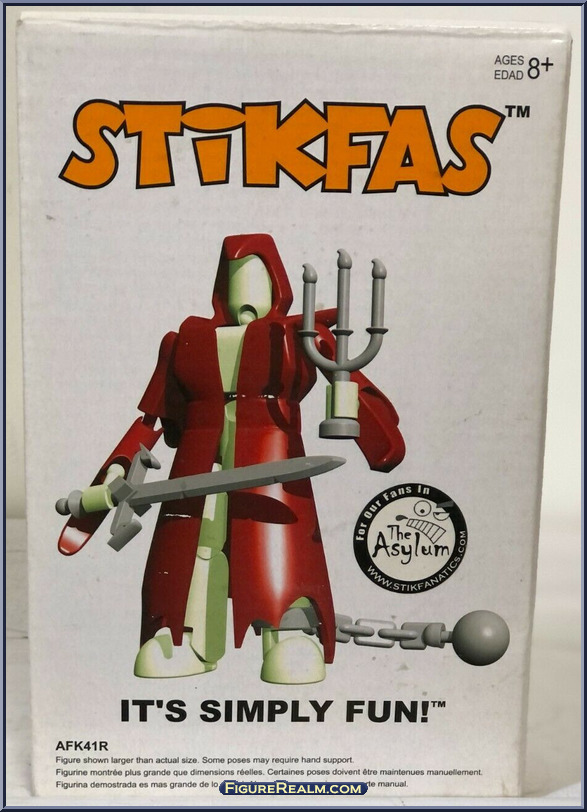
Image resolution: width=587 pixels, height=812 pixels. I want to click on candle, so click(x=377, y=309), click(x=333, y=307), click(x=305, y=309).